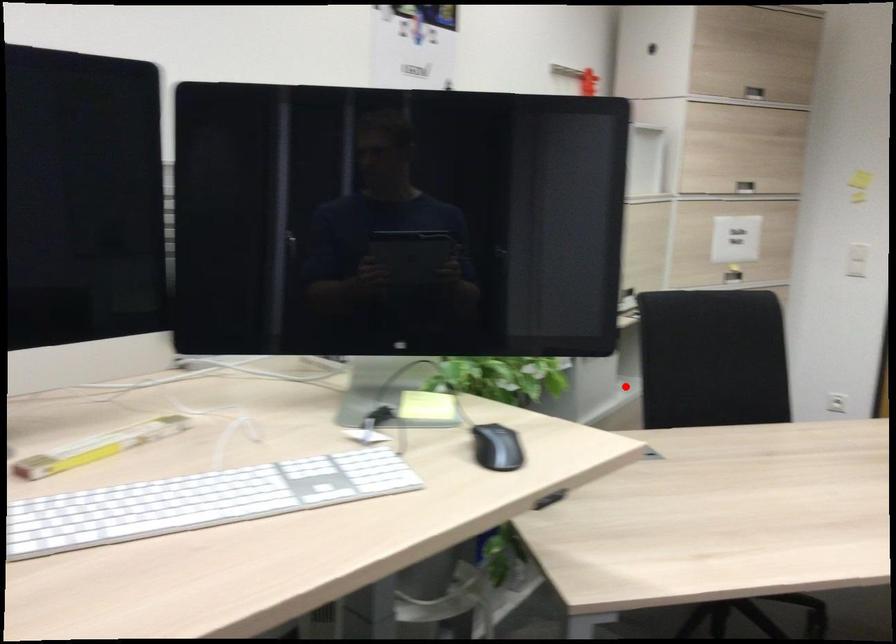
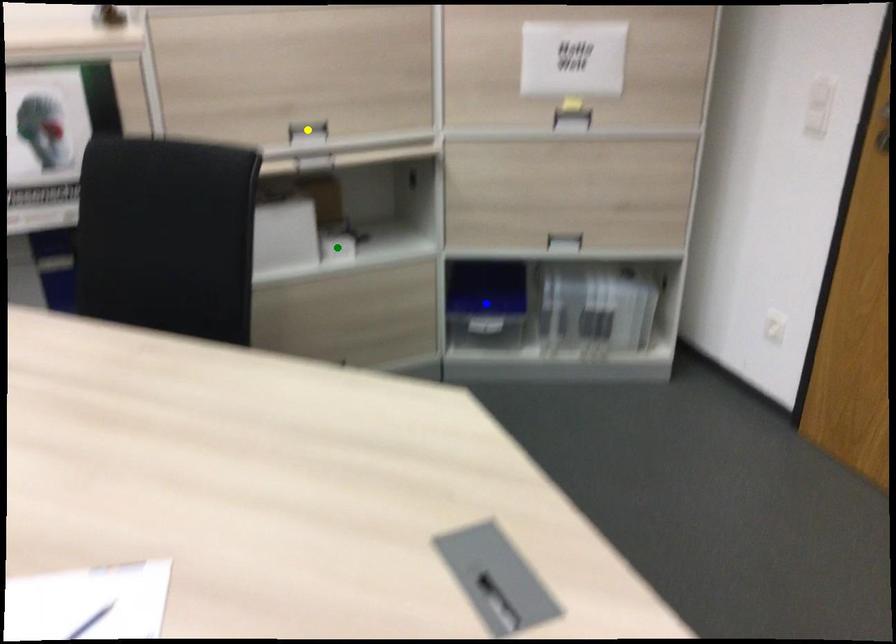
Question: I am providing you with two images of the same scene from different viewpoints. A red point is marked on the first image. You are given multiple points on the second image. Can you choose the point in image 2 that corresponds to the point in image 1?

Choices:
 (A) yellow point
 (B) green point
 (C) blue point

Answer: (B)